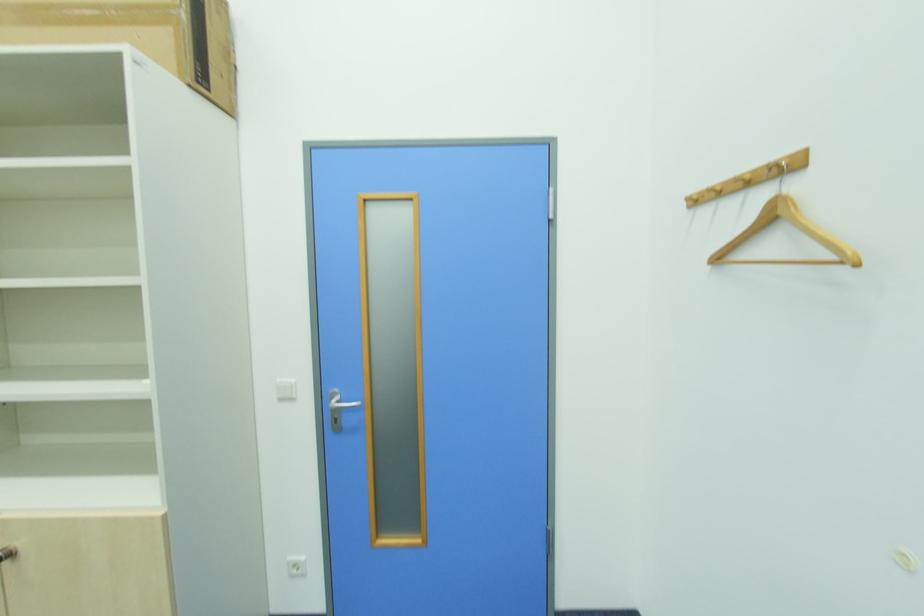
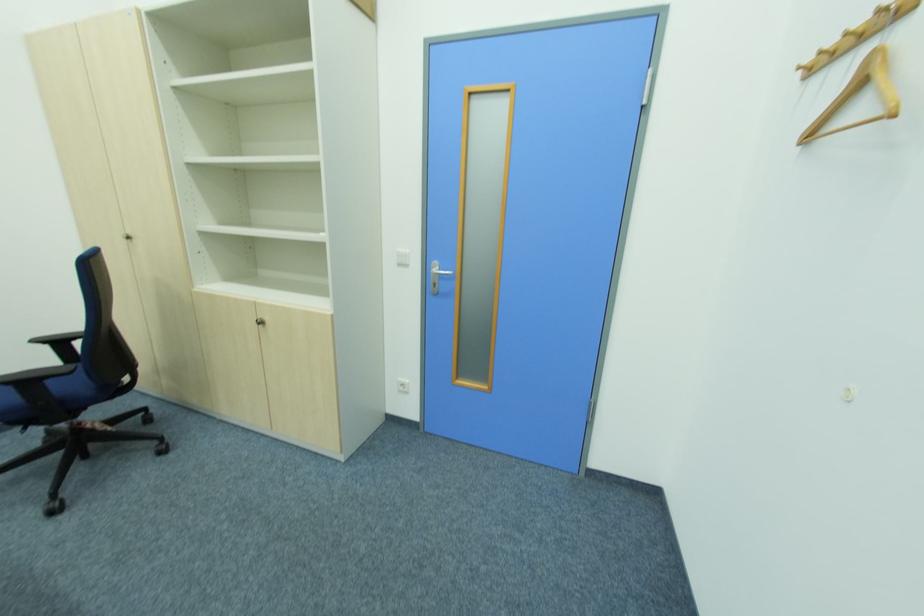
Where in the second image is the point corresponding to [299,569] from the first image?

(407, 387)